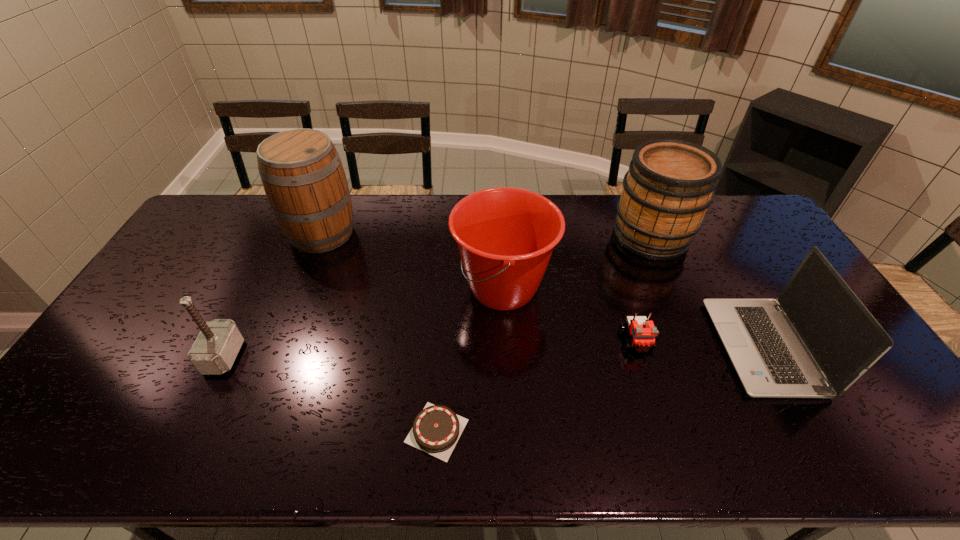
Identify the location of object located in the right edge section of the desktop. The image size is (960, 540). (817, 339).

You are a GUI agent. You are given a task and a screenshot of the screen. Output one action in this format:
    pyautogui.click(x=<x>, y=<y>)
    Task: Click on the free space at the far edge of the desktop
    The image size is (960, 540).
    Given the screenshot: What is the action you would take?
    pyautogui.click(x=396, y=195)

Identify the location of blank space at the near edge of the desktop. (707, 449).

The height and width of the screenshot is (540, 960). In the image, there is a desktop. What are the coordinates of `free space at the left edge` in the screenshot? It's located at (205, 255).

You are a GUI agent. You are given a task and a screenshot of the screen. Output one action in this format:
    pyautogui.click(x=<x>, y=<y>)
    Task: Click on the vacant space in between the hammer and the nearest object
    This screenshot has height=540, width=960.
    Given the screenshot: What is the action you would take?
    pyautogui.click(x=330, y=394)

The image size is (960, 540). Identify the location of vacant point located between the right cider and the laptop computer. (707, 291).

Where is `free space that is in between the shortest object and the left cider`? Image resolution: width=960 pixels, height=540 pixels. free space that is in between the shortest object and the left cider is located at coordinates (379, 332).

Locate an element on the screen. The width and height of the screenshot is (960, 540). empty location between the Lego and the bucket is located at coordinates (x=569, y=315).

The image size is (960, 540). I want to click on free space between the bucket and the right cider, so click(577, 262).

The image size is (960, 540). In order to click on free space between the Lego and the hammer in this screenshot , I will do `click(430, 349)`.